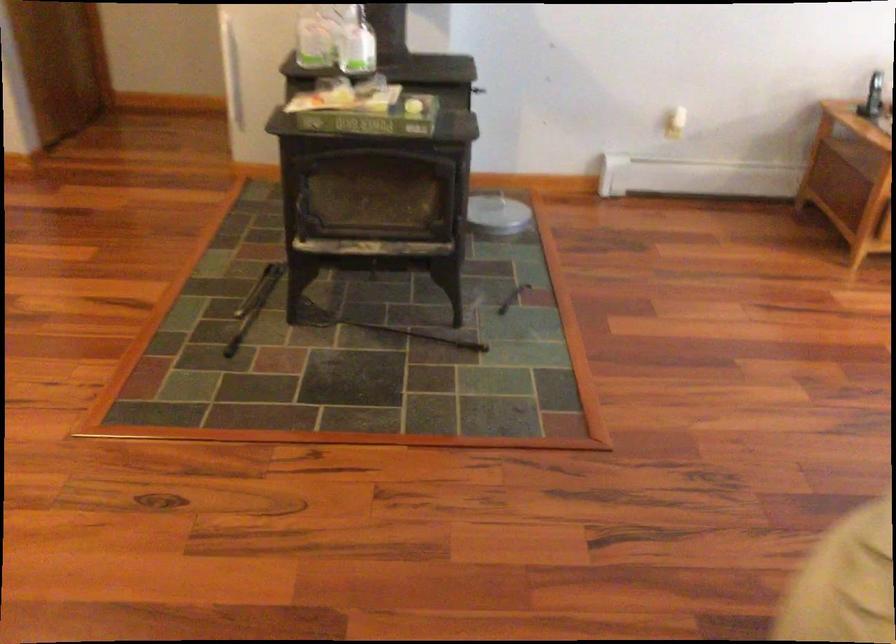
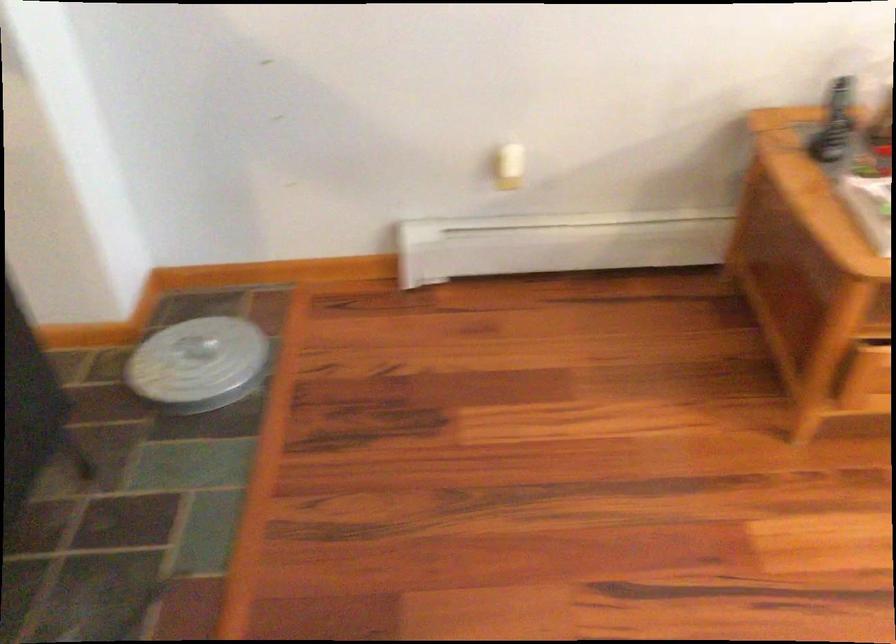
In a continuous first-person perspective shot, in which direction is the camera moving?

The cameraman walked toward right, forward.